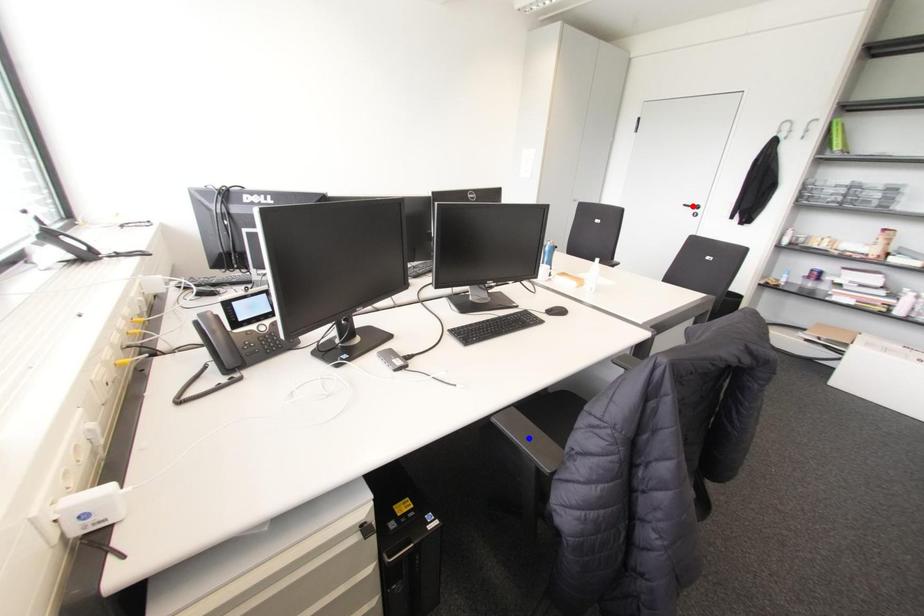
Question: Two points are marked on the image. Which point is closer to the camera?

Choices:
 (A) Blue point is closer.
 (B) Red point is closer.

Answer: (A)